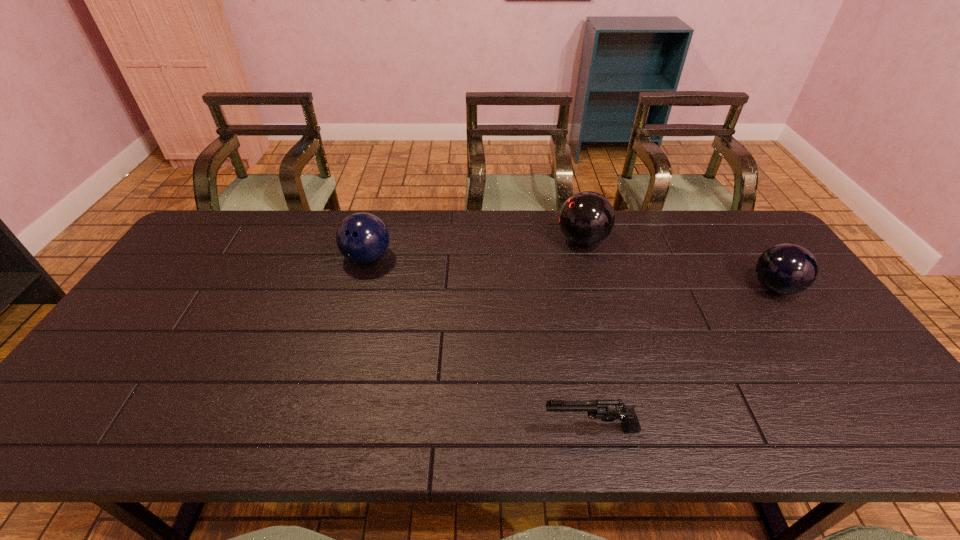
Identify the location of the second bowling ball from right to left. This screenshot has height=540, width=960. (587, 218).

The width and height of the screenshot is (960, 540). I want to click on the leftmost object, so pyautogui.click(x=362, y=238).

Locate an element on the screen. The height and width of the screenshot is (540, 960). the rightmost bowling ball is located at coordinates (786, 269).

Locate an element on the screen. This screenshot has height=540, width=960. the nearest object is located at coordinates (607, 410).

I want to click on the shortest object, so click(x=607, y=410).

The width and height of the screenshot is (960, 540). I want to click on free space located 0.390m on the surface of the second bowling ball from right to left near the finger holes, so click(438, 240).

At what (x,y) coordinates should I click in order to perform the action: click on free space located 0.080m on the surface of the second bowling ball from right to left near the finger holes. Please return your answer as a coordinate pair (x, y). Looking at the image, I should click on (532, 240).

The height and width of the screenshot is (540, 960). I want to click on free space located on the surface of the second bowling ball from right to left near the finger holes, so click(x=484, y=240).

What are the coordinates of `free space located 0.400m on the surface of the leftmost object near the finger holes` in the screenshot? It's located at (329, 391).

Image resolution: width=960 pixels, height=540 pixels. Find the location of `free space located on the side of the rightmost object with the finger holes`. free space located on the side of the rightmost object with the finger holes is located at coordinates (691, 288).